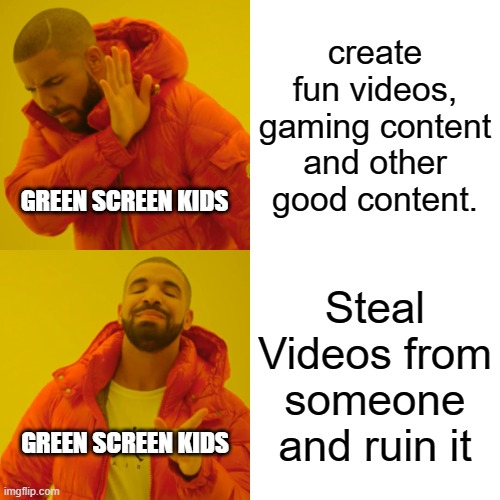
Where is `coat`? This screenshot has height=500, width=500. coat is located at coordinates (197, 387), (185, 119).